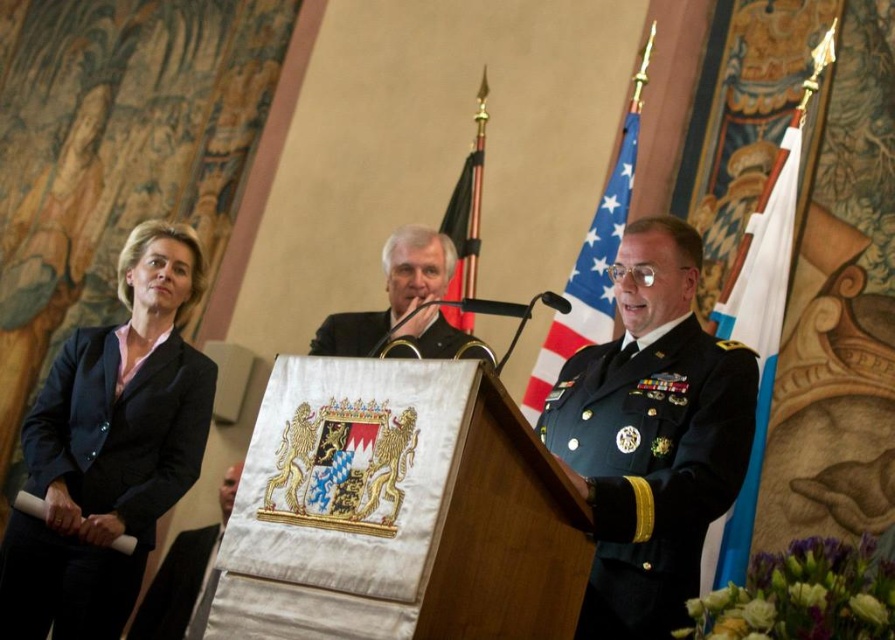
Is american flag at center below black fabric uniform at left?

No.

Does american flag at center have a lesser width compared to black fabric uniform at left?

No.

This screenshot has height=640, width=895. I want to click on american flag at center, so click(587, 275).

Where is `american flag at center`? american flag at center is located at coordinates (587, 275).

Who is shorter, white fabric flag at right or black fabric uniform at left?

black fabric uniform at left

Identify the location of white fabric flag at right. (760, 317).

Where is `white fabric flag at right`? The width and height of the screenshot is (895, 640). white fabric flag at right is located at coordinates (760, 317).

Is navy blue fabric suit at left positioned in front of white fabric flag at right?

No, navy blue fabric suit at left is further to the viewer.

Is the position of navy blue fabric suit at left more distant than that of white fabric flag at right?

Yes, it is.

This screenshot has height=640, width=895. Identify the location of navy blue fabric suit at left. (101, 480).